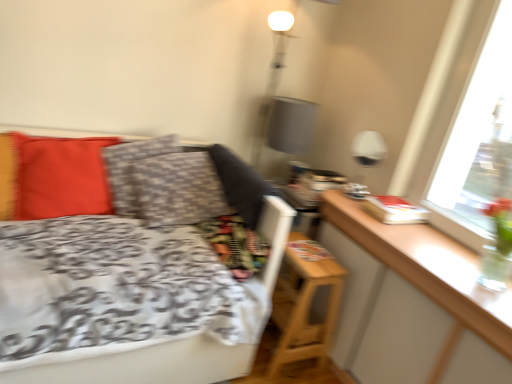
Where is `empty space that is ontop of wooden table at right`? empty space that is ontop of wooden table at right is located at coordinates (426, 243).